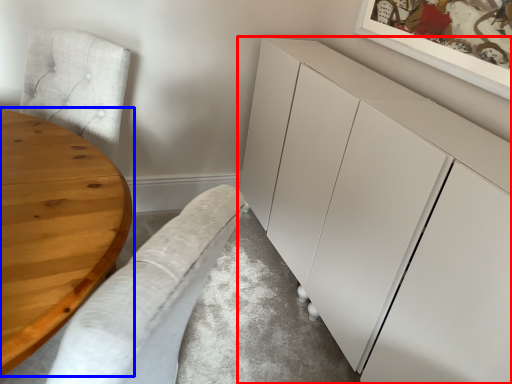
Question: Which point is further to the camera, cabinetry (highlighted by a red box) or table (highlighted by a blue box)?

Choices:
 (A) cabinetry
 (B) table

Answer: (A)